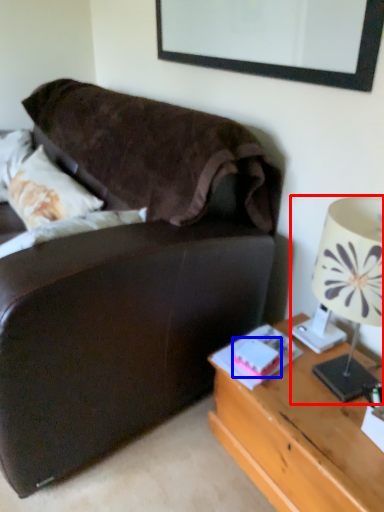
Question: Which object appears closest to the camera in this image, lamp (highlighted by a red box) or book (highlighted by a blue box)?

Choices:
 (A) lamp
 (B) book

Answer: (A)